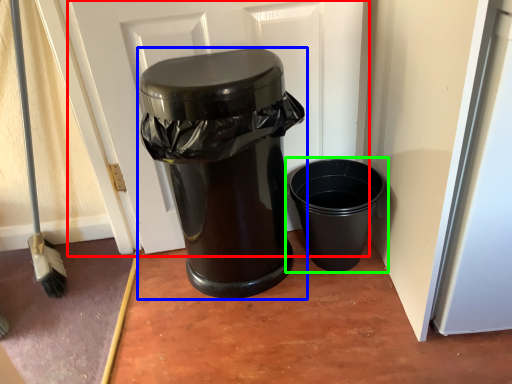
Question: Which is farther away from screen door (highlighted by a red box)? waste container (highlighted by a blue box) or waste container (highlighted by a green box)?

Choices:
 (A) waste container
 (B) waste container

Answer: (B)